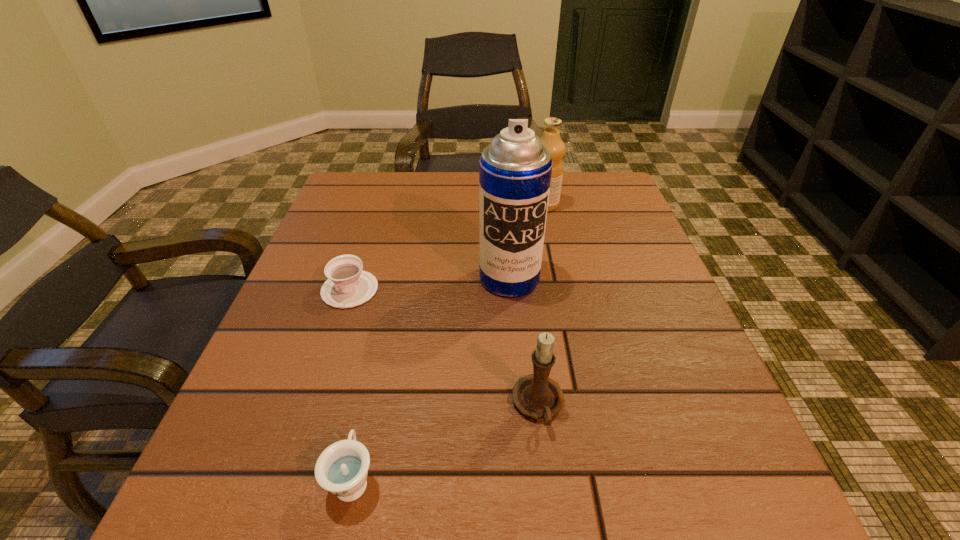
In the image, there is a desktop. Identify the location of free space at the near edge. This screenshot has width=960, height=540. (636, 477).

In the image, there is a desktop. In order to click on vacant space at the left edge in this screenshot , I will do `click(295, 314)`.

In the image, there is a desktop. Where is `vacant space at the right edge`? vacant space at the right edge is located at coordinates (713, 386).

This screenshot has width=960, height=540. In the image, there is a desktop. Identify the location of free space at the far left corner. (351, 213).

Locate an element on the screen. This screenshot has width=960, height=540. vacant space at the near left corner is located at coordinates pyautogui.click(x=312, y=504).

In order to click on free space between the fourth farthest object and the olive oil in this screenshot , I will do `click(541, 305)`.

Locate an element on the screen. The height and width of the screenshot is (540, 960). vacant region between the candle holder and the nearest object is located at coordinates (445, 442).

Identify the location of empty space between the nearest object and the tallest object. (431, 379).

This screenshot has height=540, width=960. What are the coordinates of `free spot between the farther teacup and the third tallest object` in the screenshot? It's located at (444, 348).

The image size is (960, 540). Identify the location of free point between the nearest object and the aerosol can. (431, 379).